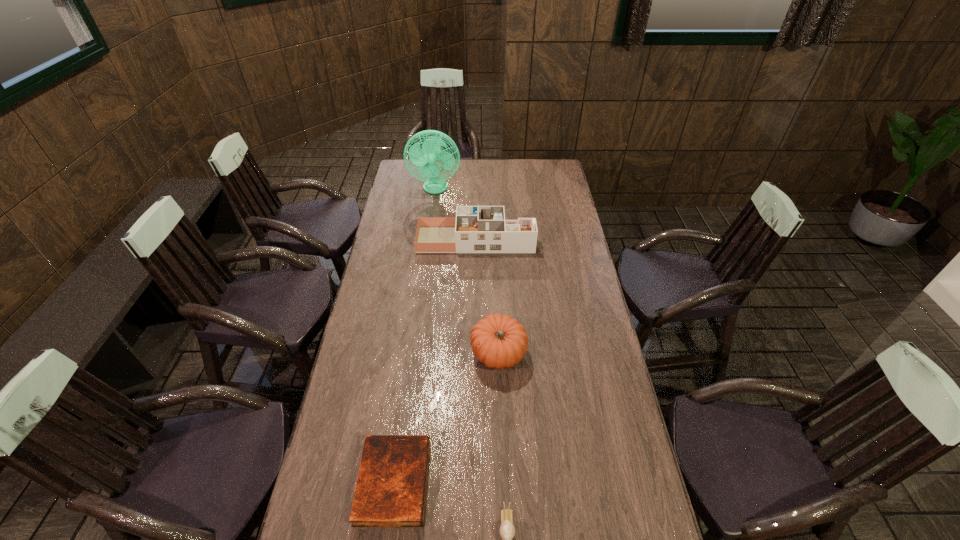
You are a GUI agent. You are given a task and a screenshot of the screen. Output one action in this format:
    pyautogui.click(x=<x>, y=<y>)
    Task: Click on the blank region between the Bible and the fan
    
    Given the screenshot: What is the action you would take?
    pyautogui.click(x=415, y=335)

Image resolution: width=960 pixels, height=540 pixels. I want to click on vacant area that lies between the fan and the pumpkin, so click(x=467, y=272).

I want to click on object that can be found as the closest to the dollhouse, so click(426, 158).

I want to click on object that is the closest one to the dollhouse, so click(x=426, y=158).

The height and width of the screenshot is (540, 960). Find the location of `vacant region that satisfies the following two spatial constraints: 1. on the back side of the pumpkin; 2. at the entrance of the fourth nearest object`. vacant region that satisfies the following two spatial constraints: 1. on the back side of the pumpkin; 2. at the entrance of the fourth nearest object is located at coordinates (494, 239).